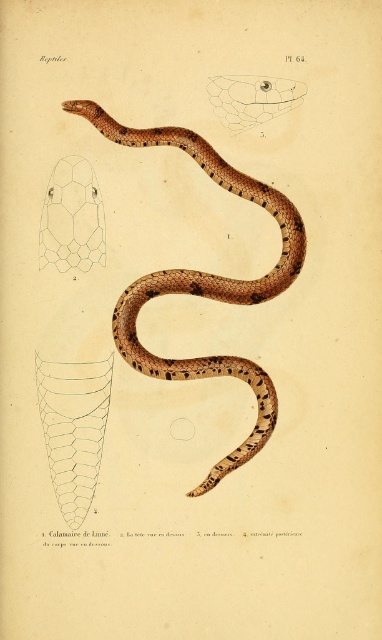
You are examining the scientific illustration of the snake labeled as Calamaria de Linne. You notice two points marked on the image at coordinates point (132, 141) and point (45, 243). Based on the illustration, which of these points is positioned closer to the viewer?

Point (132, 141) is closer to the camera than point (45, 243).

Based on the provided image description, what can be found at the coordinates point [205,282]?

The point [205,282] is where the brown scaly snake at center is located.

Based on the illustration, can you determine which object is larger between the brown scaly snake at center and the translucent hexagonal pattern at upper left?

The brown scaly snake at center is bigger than the translucent hexagonal pattern at upper left according to the illustration.